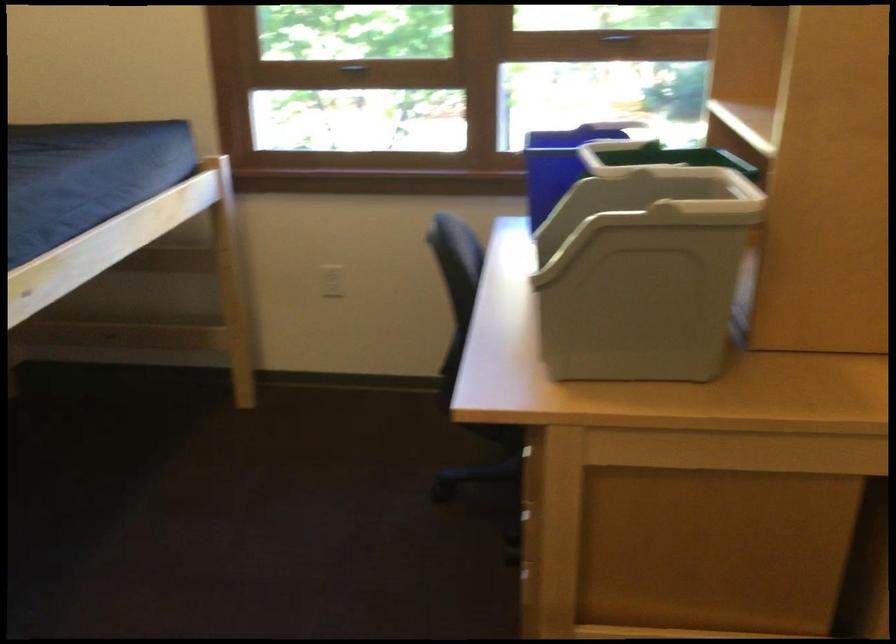
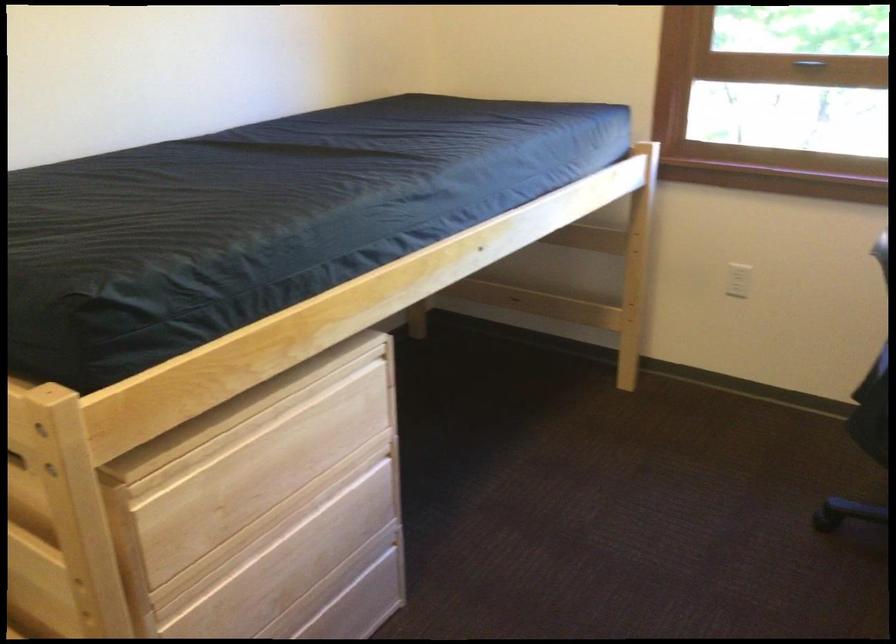
Locate, in the second image, the point that corresponds to (x=332, y=283) in the first image.

(738, 279)